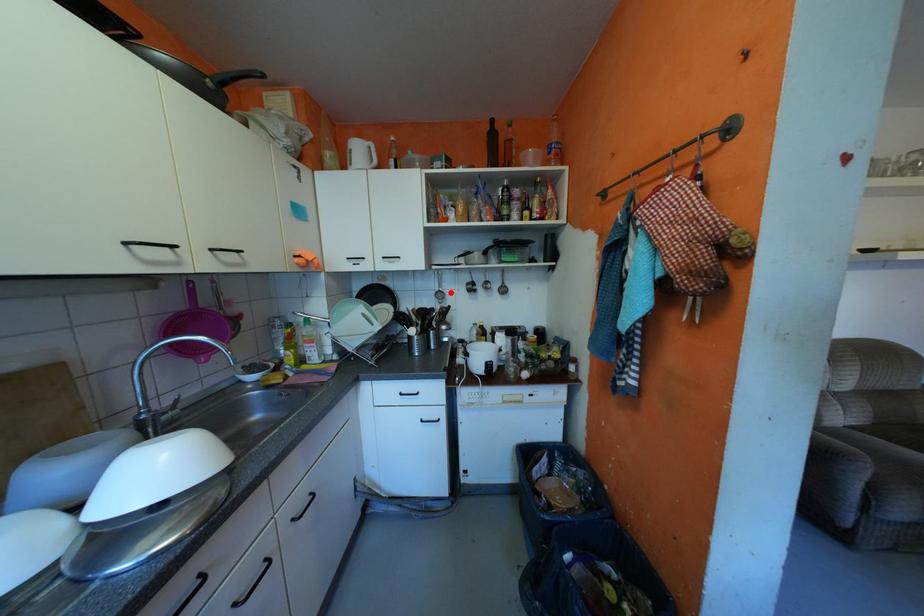
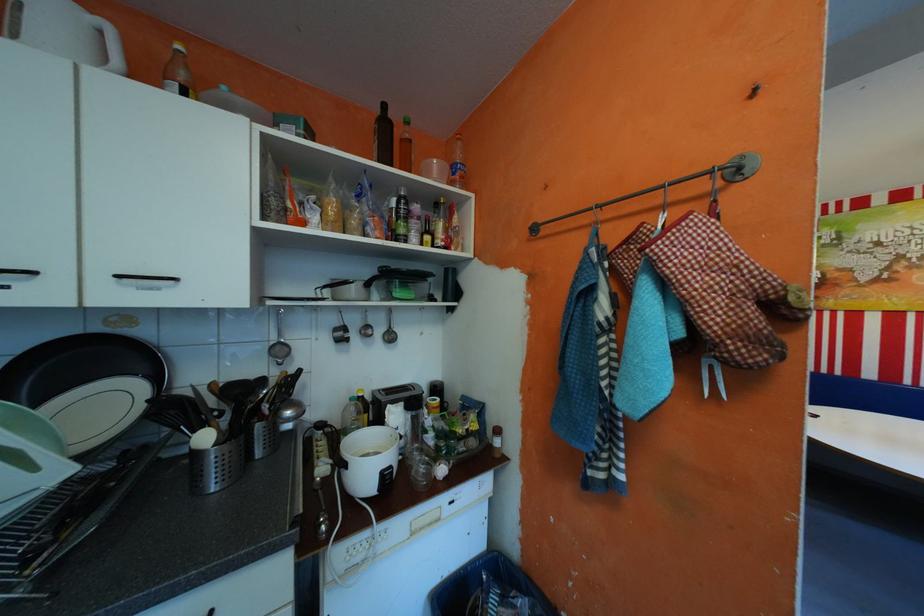
Find the pixel in the second image that matches the highlighted location in the first image.

(289, 346)